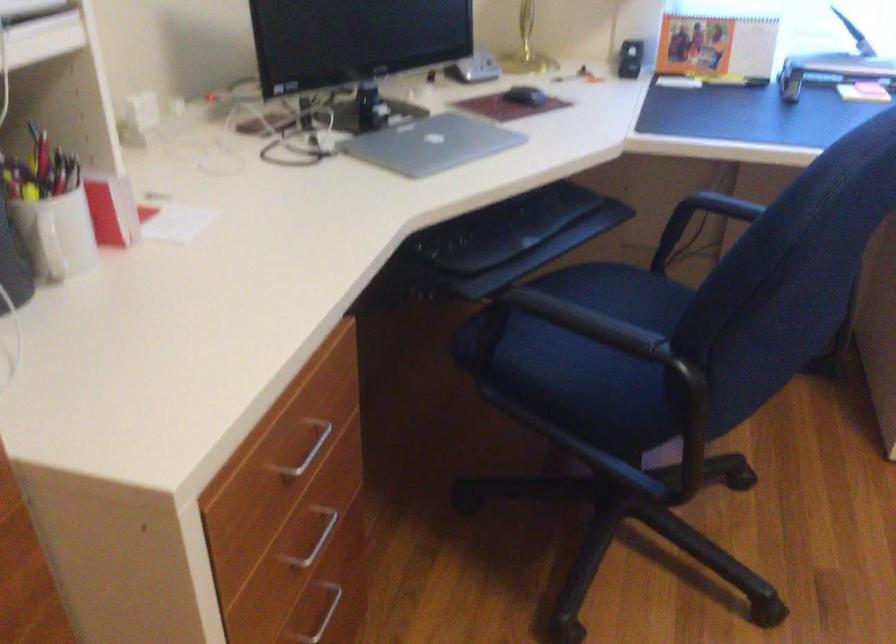
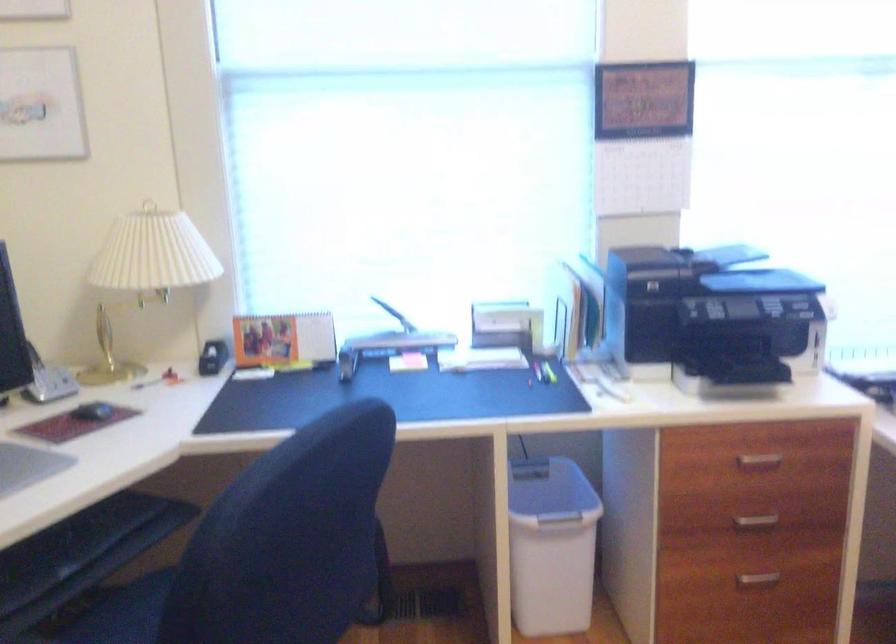
Question: The camera is either moving clockwise (left) or counter-clockwise (right) around the object. The first image is from the beginning of the video and the second image is from the end. Is the camera moving left or right when shooting the video?

Choices:
 (A) Left
 (B) Right

Answer: (A)